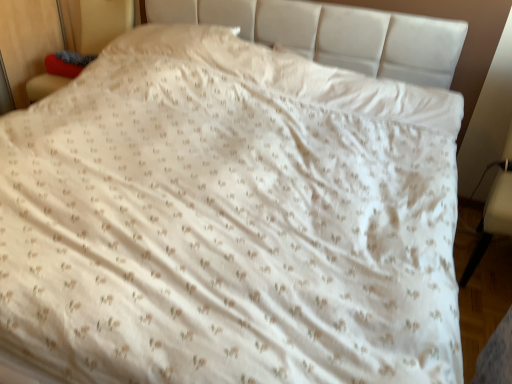
Question: Do you think matte red cushion at left, which is the 2th armchair in bottom-to-top order, is within white leather armchair at lower right, the 2th armchair viewed from the top, or outside of it?

Choices:
 (A) outside
 (B) inside

Answer: (A)

Question: Is matte red cushion at left, the first armchair in the left-to-right sequence, wider or thinner than white leather armchair at lower right, the 2th armchair viewed from the top?

Choices:
 (A) wide
 (B) thin

Answer: (B)

Question: From the image's perspective, is matte red cushion at left, the first armchair in the left-to-right sequence, located above or below white leather armchair at lower right, the first armchair when ordered from bottom to top?

Choices:
 (A) below
 (B) above

Answer: (B)

Question: Based on their positions, is white leather armchair at lower right, the second armchair in the left-to-right sequence, located to the left or right of matte red cushion at left, the second armchair in the right-to-left sequence?

Choices:
 (A) right
 (B) left

Answer: (A)

Question: Is point (506, 210) positioned closer to the camera than point (96, 18)?

Choices:
 (A) closer
 (B) farther

Answer: (A)

Question: From the image's perspective, is white leather armchair at lower right, the 2th armchair viewed from the top, above or below matte red cushion at left, which is the 2th armchair in bottom-to-top order?

Choices:
 (A) below
 (B) above

Answer: (A)

Question: Considering the positions of white leather armchair at lower right, the 2th armchair viewed from the top, and matte red cushion at left, the second armchair in the right-to-left sequence, in the image, is white leather armchair at lower right, the 2th armchair viewed from the top, bigger or smaller than matte red cushion at left, the second armchair in the right-to-left sequence,?

Choices:
 (A) small
 (B) big

Answer: (A)